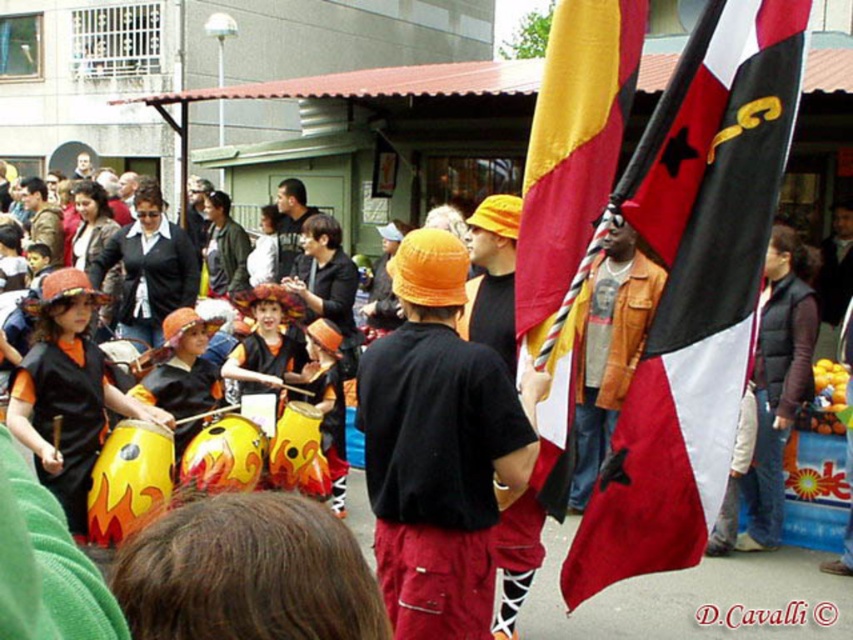
Question: Can you confirm if brown quilted vest at right is bigger than brown leather jacket at center?

Choices:
 (A) no
 (B) yes

Answer: (A)

Question: Is red fabric flag at right wider than orange matte drum at left?

Choices:
 (A) no
 (B) yes

Answer: (B)

Question: Among these points, which one is nearest to the camera?

Choices:
 (A) (235, 372)
 (B) (637, 340)

Answer: (A)

Question: Which of the following is the farthest from the observer?

Choices:
 (A) (36, 465)
 (B) (641, 256)
 (C) (666, 234)
 (D) (271, 365)

Answer: (B)

Question: Does orange matte drum at left have a larger size compared to brown quilted vest at right?

Choices:
 (A) no
 (B) yes

Answer: (B)

Question: Which point is farther from the camera taking this photo?

Choices:
 (A) (564, 369)
 (B) (262, 333)
 (C) (630, 333)
 (D) (767, 212)

Answer: (B)